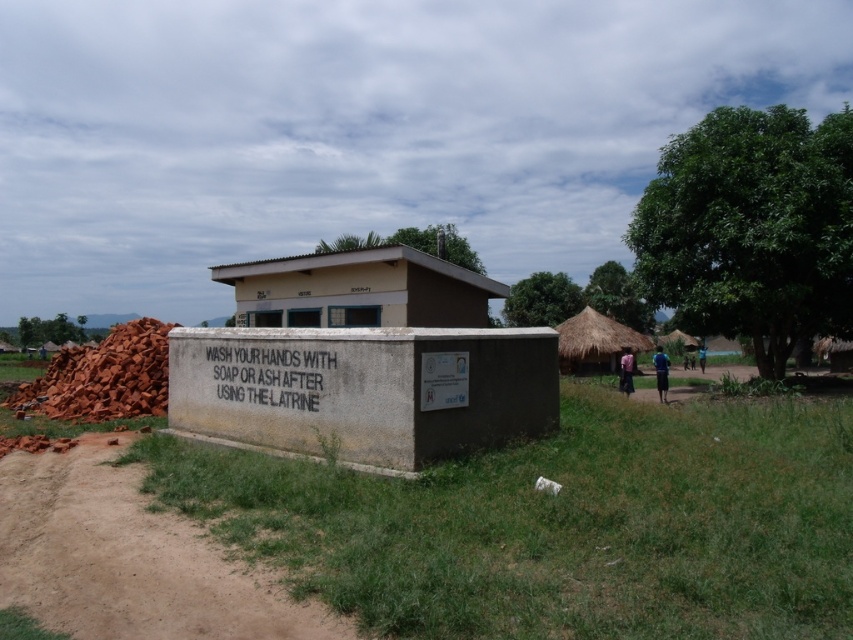
Question: Which object appears closest to the camera in this image?

Choices:
 (A) concrete wall at center
 (B) pink fabric dress at lower right
 (C) brown dirt field at lower left
 (D) dark blue fabric at center

Answer: (C)

Question: Considering the real-world distances, which object is closest to the pink fabric dress at lower right?

Choices:
 (A) brown dirt track at lower left
 (B) blue fabric shirt at center-right
 (C) thatched straw hut at center

Answer: (C)

Question: Can you confirm if brown dirt field at lower left is positioned above thatched straw hut at center?

Choices:
 (A) yes
 (B) no

Answer: (B)

Question: Does thatched straw hut at center have a smaller size compared to blue fabric shirt at center-right?

Choices:
 (A) no
 (B) yes

Answer: (A)

Question: Which point is closer to the camera taking this photo?

Choices:
 (A) (817, 632)
 (B) (660, 372)
 (C) (628, 385)
 (D) (558, 352)

Answer: (A)

Question: Does brown dirt field at lower left have a lesser width compared to brown dirt track at lower left?

Choices:
 (A) yes
 (B) no

Answer: (B)